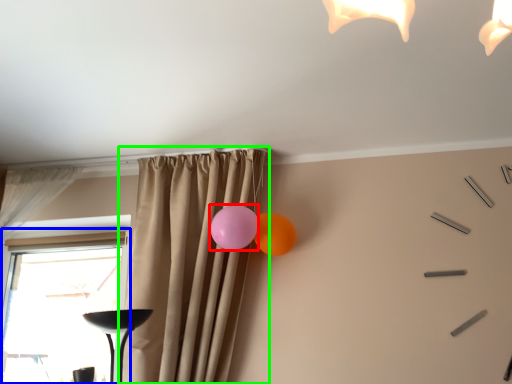
Question: Estimate the real-world distances between objects in this image. Which object is closer to balloon (highlighted by a red box), window (highlighted by a blue box) or curtain (highlighted by a green box)?

Choices:
 (A) window
 (B) curtain

Answer: (B)